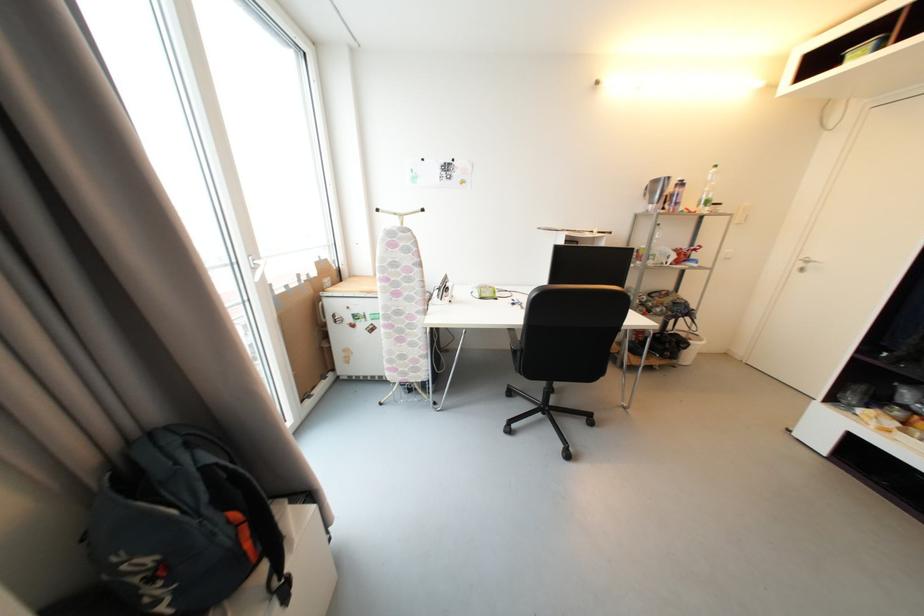
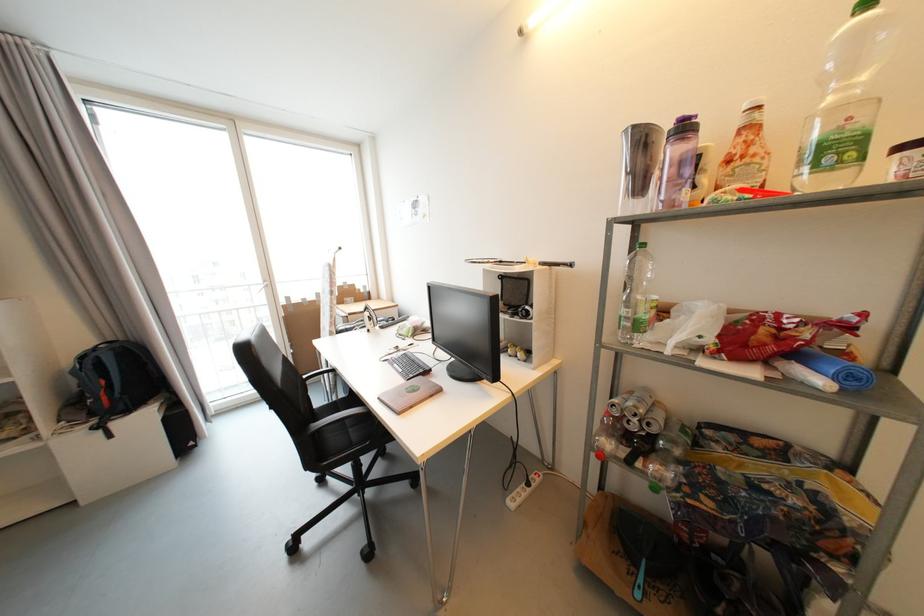
Where in the second image is the point corresponding to [712,204] from the first image?

(842, 151)